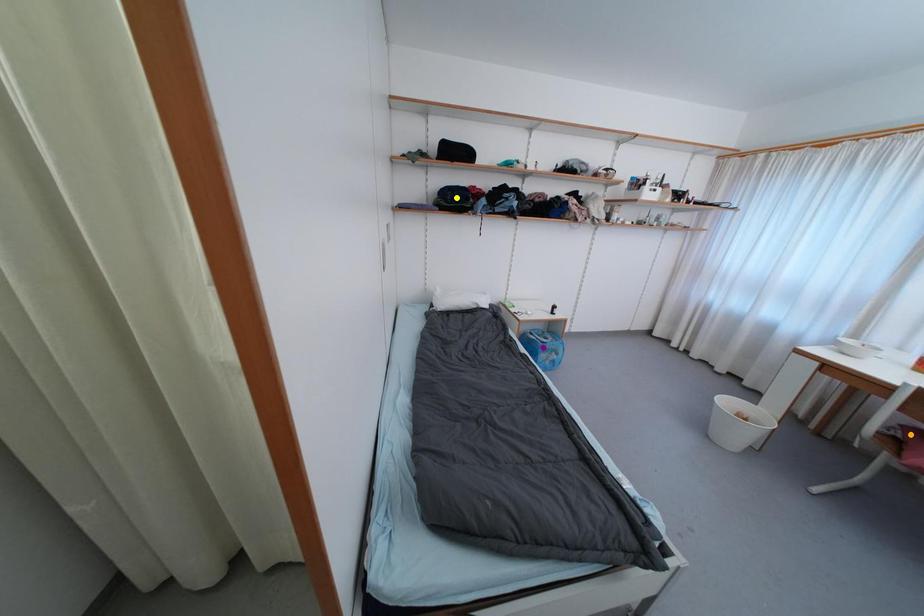
Order these from farthest to nearest:
orange point, yellow point, purple point

purple point, yellow point, orange point